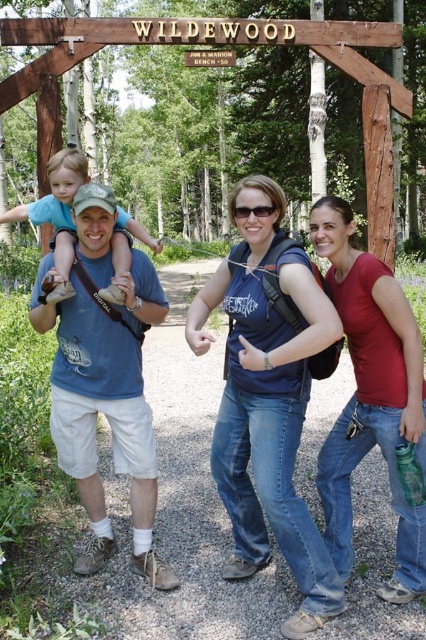
You are a photographer trying to position two subjects wearing the blue denim jeans at center and the matte blue shirt at center for a photo. Which subject should you direct to move to the left to create more space between them?

The blue denim jeans at center is positioned on the right side of matte blue shirt at center. To create more space between them, you should direct the subject wearing the blue denim jeans at center to move to the left.

From the picture: You are standing at the edge of the forest path and see the blue denim jeans at center and the matte red shirt at center. Which one is closer to you?

The blue denim jeans at center is closer to the viewer than the matte red shirt at center.